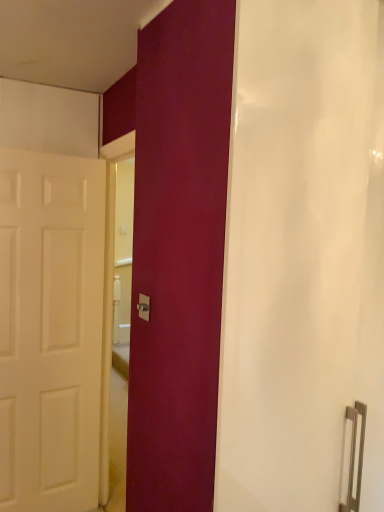
Question: Considering the relative positions of white matte door at left and matte silver switch at center in the image provided, is white matte door at left to the left of matte silver switch at center from the viewer's perspective?

Choices:
 (A) yes
 (B) no

Answer: (A)

Question: Considering the relative sizes of white matte door at left and matte silver switch at center in the image provided, is white matte door at left taller than matte silver switch at center?

Choices:
 (A) no
 (B) yes

Answer: (B)

Question: Does white matte door at left have a lesser height compared to matte silver switch at center?

Choices:
 (A) no
 (B) yes

Answer: (A)

Question: Does white matte door at left have a larger size compared to matte silver switch at center?

Choices:
 (A) no
 (B) yes

Answer: (B)

Question: Does white matte door at left have a greater width compared to matte silver switch at center?

Choices:
 (A) yes
 (B) no

Answer: (A)

Question: From the image's perspective, is white matte door at left above or below matte silver switch at center?

Choices:
 (A) below
 (B) above

Answer: (A)

Question: Does point (87, 508) appear closer or farther from the camera than point (142, 296)?

Choices:
 (A) closer
 (B) farther

Answer: (B)

Question: In terms of width, does white matte door at left look wider or thinner when compared to matte silver switch at center?

Choices:
 (A) thin
 (B) wide

Answer: (B)

Question: Considering the positions of white matte door at left and matte silver switch at center in the image, is white matte door at left bigger or smaller than matte silver switch at center?

Choices:
 (A) big
 (B) small

Answer: (A)

Question: From the image's perspective, is matte white shower curtain at center positioned above or below matte silver switch at center?

Choices:
 (A) below
 (B) above

Answer: (A)

Question: Considering their positions, is matte white shower curtain at center located in front of or behind matte silver switch at center?

Choices:
 (A) front
 (B) behind

Answer: (A)

Question: Is point (289, 339) closer or farther from the camera than point (145, 309)?

Choices:
 (A) farther
 (B) closer

Answer: (B)

Question: Which is correct: matte white shower curtain at center is inside matte silver switch at center, or outside of it?

Choices:
 (A) outside
 (B) inside

Answer: (A)

Question: Is white matte door at left spatially inside matte white shower curtain at center, or outside of it?

Choices:
 (A) inside
 (B) outside

Answer: (B)

Question: Is point (61, 501) closer or farther from the camera than point (352, 402)?

Choices:
 (A) farther
 (B) closer

Answer: (A)